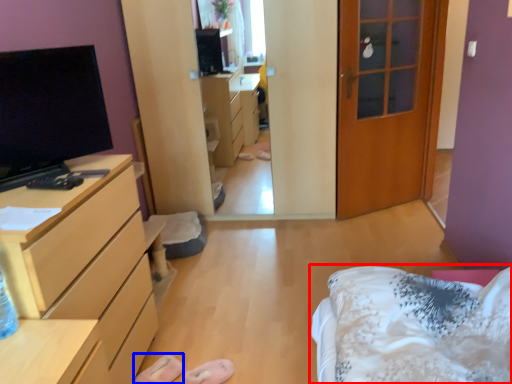
Question: Among these objects, which one is nearest to the camera, bed (highlighted by a red box) or shoe (highlighted by a blue box)?

Choices:
 (A) bed
 (B) shoe

Answer: (A)